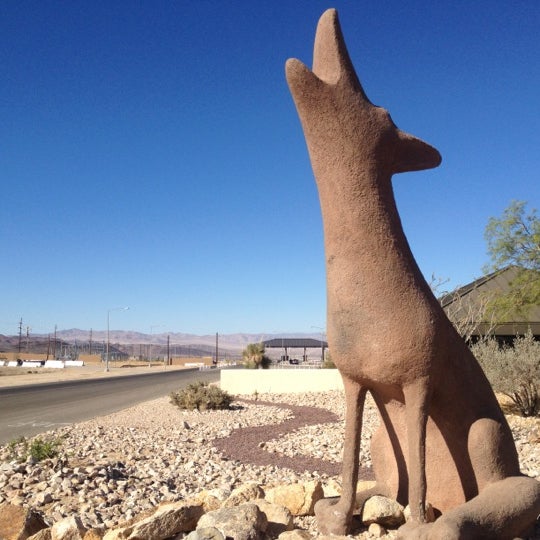
What are the coordinates of `dog statue` in the screenshot? It's located at click(x=382, y=154).